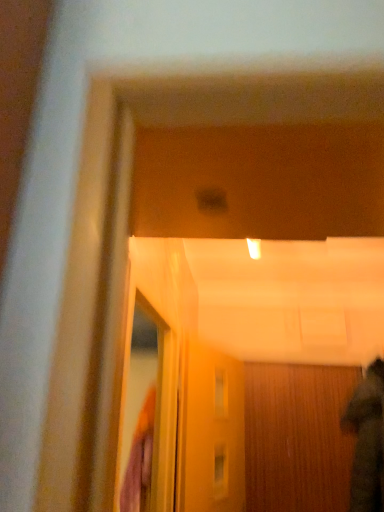
What do you see at coordinates (367, 441) in the screenshot? I see `dark gray fabric at right` at bounding box center [367, 441].

This screenshot has width=384, height=512. Find the location of `dark gray fabric at right`. dark gray fabric at right is located at coordinates (367, 441).

You are a GUI agent. You are given a task and a screenshot of the screen. Output one action in this format:
    pyautogui.click(x=<x>, y=<y>)
    Task: Click on the dark gray fabric at right
    Image resolution: width=384 pixels, height=512 pixels.
    Given the screenshot: What is the action you would take?
    pyautogui.click(x=367, y=441)